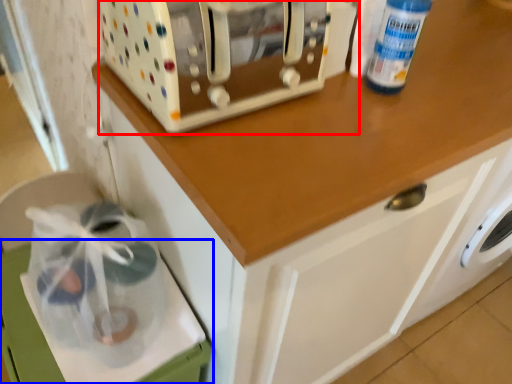
Question: Which object is further to the camera taking this photo, home appliance (highlighted by a red box) or cabinetry (highlighted by a blue box)?

Choices:
 (A) home appliance
 (B) cabinetry

Answer: (B)